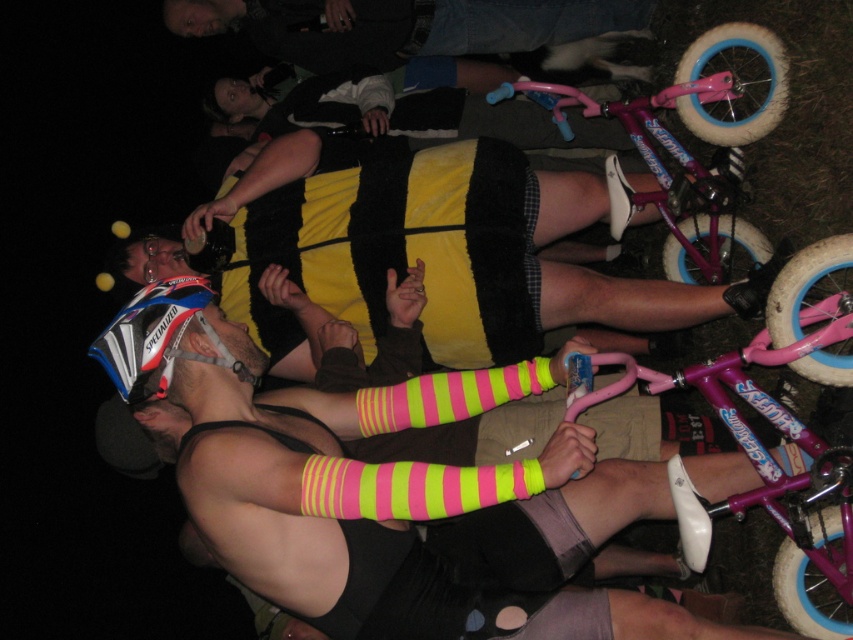
Question: Which of the following is the closest to the observer?

Choices:
 (A) matte black helmet at left
 (B) yellow/black fuzzy shorts at center

Answer: (A)

Question: Which point appears farthest from the camera in this image?

Choices:
 (A) (315, 259)
 (B) (164, 310)
 (C) (216, 480)
 (D) (440, 33)

Answer: (D)

Question: From the image, what is the correct spatial relationship of yellow/black fuzzy shorts at center in relation to neon striped socks at center?

Choices:
 (A) above
 (B) below

Answer: (A)

Question: Considering the real-world distances, which object is closest to the yellow/black fuzzy shorts at center?

Choices:
 (A) denim pants at upper center
 (B) matte black helmet at left
 (C) neon striped socks at center

Answer: (C)

Question: Does denim pants at upper center have a larger size compared to matte black helmet at left?

Choices:
 (A) yes
 (B) no

Answer: (A)

Question: Is neon striped socks at center positioned in front of denim pants at upper center?

Choices:
 (A) no
 (B) yes

Answer: (B)